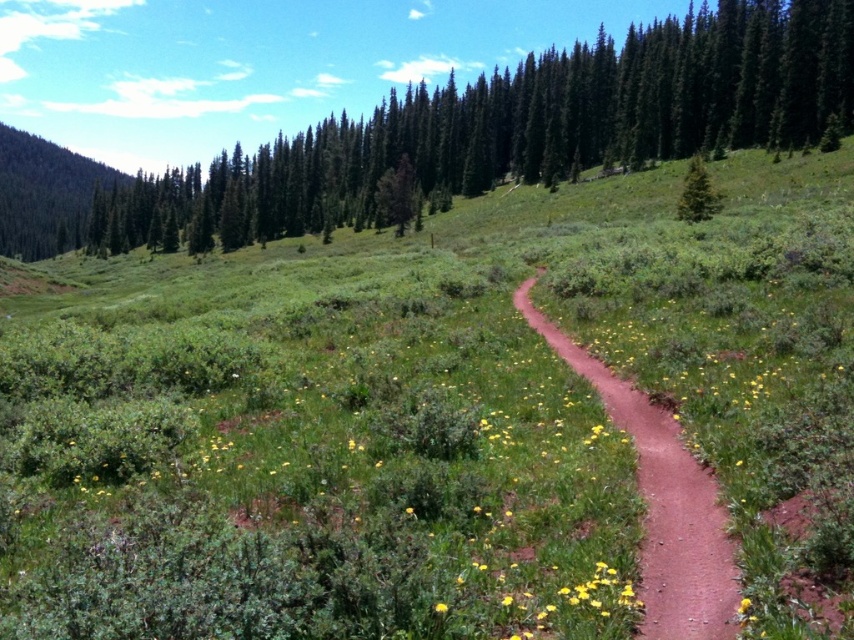
Looking at this image, you are standing at the starting point of the dirt path in the meadow. You see two points marked in the image, point A at coordinates point A is point (693, 616) and point B at coordinates point B is point (711, 186). Which point is closer to you?

Point A at coordinates point A is point (693, 616) is closer to you than point B at coordinates point B is point (711, 186).

You are a hiker planning to take a photo of the green textured tree at upper center and the green textured pine tree at upper right from the winding dirt path in the meadow. Which tree should you position yourself closer to in order to capture both in a single frame without zooming?

You should position yourself closer to the green textured pine tree at upper right because the green textured tree at upper center is much taller, so moving closer to the shorter tree will help balance their sizes in the photo frame.